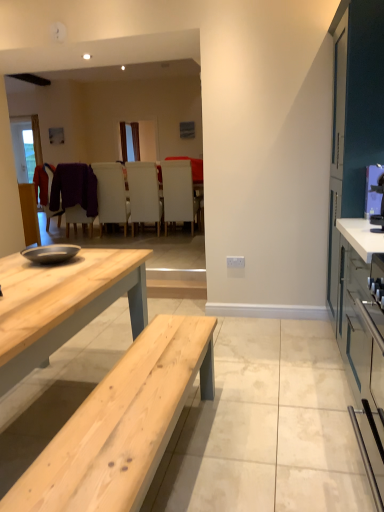
The image size is (384, 512). I want to click on free space to the left of matte gray cabinet at right, so click(278, 407).